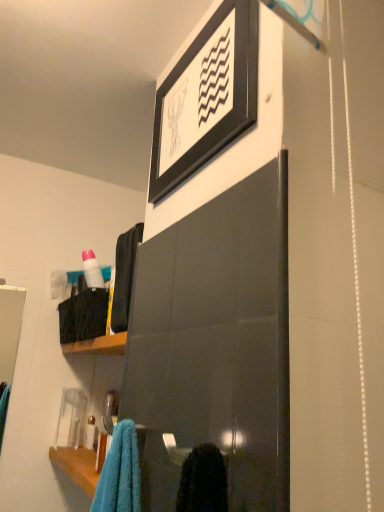
Question: Is pink glossy lotion at upper left oriented towards black matte picture frame at upper center?

Choices:
 (A) yes
 (B) no

Answer: (B)

Question: From the image's perspective, is pink glossy lotion at upper left under black matte picture frame at upper center?

Choices:
 (A) yes
 (B) no

Answer: (A)

Question: Is pink glossy lotion at upper left outside of black matte picture frame at upper center?

Choices:
 (A) no
 (B) yes

Answer: (B)

Question: Considering the relative sizes of pink glossy lotion at upper left and black matte picture frame at upper center in the image provided, is pink glossy lotion at upper left shorter than black matte picture frame at upper center?

Choices:
 (A) no
 (B) yes

Answer: (B)

Question: From the image's perspective, does pink glossy lotion at upper left appear higher than black matte picture frame at upper center?

Choices:
 (A) yes
 (B) no

Answer: (B)

Question: Is pink glossy lotion at upper left thinner than black matte picture frame at upper center?

Choices:
 (A) no
 (B) yes

Answer: (A)

Question: From the image's perspective, is black matte picture frame at upper center on pink glossy lotion at upper left?

Choices:
 (A) no
 (B) yes

Answer: (B)

Question: Considering the relative sizes of black matte picture frame at upper center and pink glossy lotion at upper left in the image provided, is black matte picture frame at upper center wider than pink glossy lotion at upper left?

Choices:
 (A) no
 (B) yes

Answer: (A)

Question: Could you tell me if black matte picture frame at upper center is turned towards pink glossy lotion at upper left?

Choices:
 (A) no
 (B) yes

Answer: (A)

Question: Is black matte picture frame at upper center looking in the opposite direction of pink glossy lotion at upper left?

Choices:
 (A) yes
 (B) no

Answer: (B)

Question: Does black matte picture frame at upper center have a lesser height compared to pink glossy lotion at upper left?

Choices:
 (A) no
 (B) yes

Answer: (A)

Question: From the image's perspective, is black matte picture frame at upper center beneath pink glossy lotion at upper left?

Choices:
 (A) yes
 (B) no

Answer: (B)

Question: Does point (200, 36) appear closer or farther from the camera than point (86, 280)?

Choices:
 (A) closer
 (B) farther

Answer: (A)